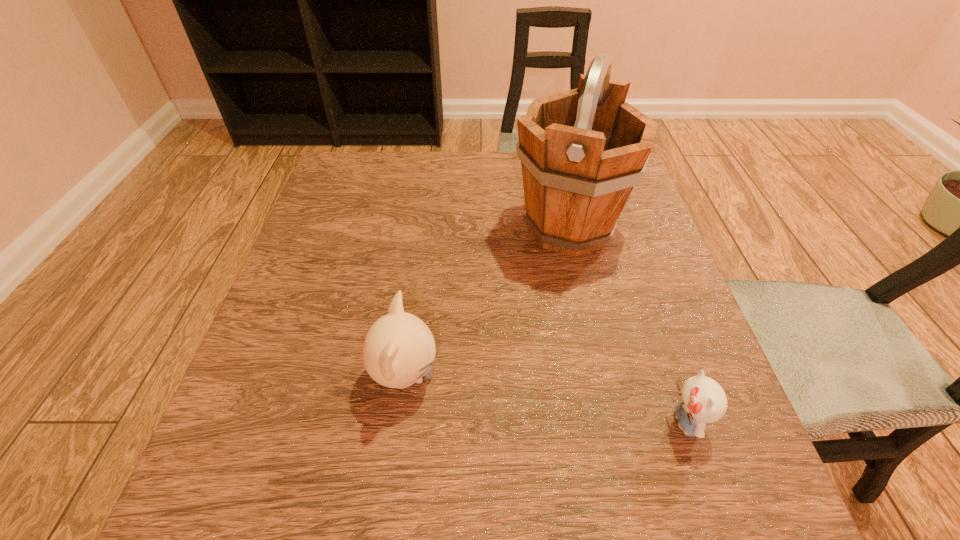
The height and width of the screenshot is (540, 960). Find the location of `bucket`. bucket is located at coordinates (582, 151).

Image resolution: width=960 pixels, height=540 pixels. Identify the location of the farthest object. (582, 151).

I want to click on the taller kitten, so click(399, 349).

I want to click on the leftmost object, so click(x=399, y=349).

I want to click on the shorter kitten, so click(x=702, y=400).

You are a GUI agent. You are given a task and a screenshot of the screen. Output one action in this format:
    pyautogui.click(x=<x>, y=<y>)
    Task: Click on the shortest object
    The width and height of the screenshot is (960, 540).
    Given the screenshot: What is the action you would take?
    pyautogui.click(x=702, y=400)

Find the location of a particular element. The width and height of the screenshot is (960, 540). vacant space located 0.350m on the front of the bucket is located at coordinates (612, 425).

At what (x,y) coordinates should I click in order to perform the action: click on blank space located on the face of the left kitten. Please return your answer as a coordinate pair (x, y). The image size is (960, 540). Looking at the image, I should click on (583, 376).

You are a GUI agent. You are given a task and a screenshot of the screen. Output one action in this format:
    pyautogui.click(x=<x>, y=<y>)
    Task: Click on the vacant region located on the front-facing side of the shortest object
    The image size is (960, 540).
    Given the screenshot: What is the action you would take?
    pyautogui.click(x=540, y=422)

The height and width of the screenshot is (540, 960). What are the coordinates of `vacant space located 0.250m on the front-facing side of the shortest object` in the screenshot? It's located at (510, 422).